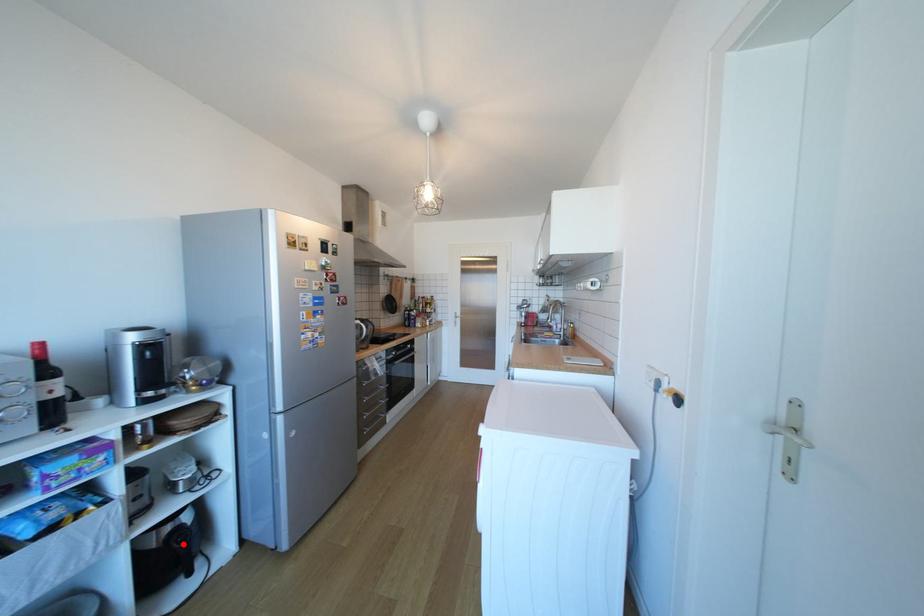
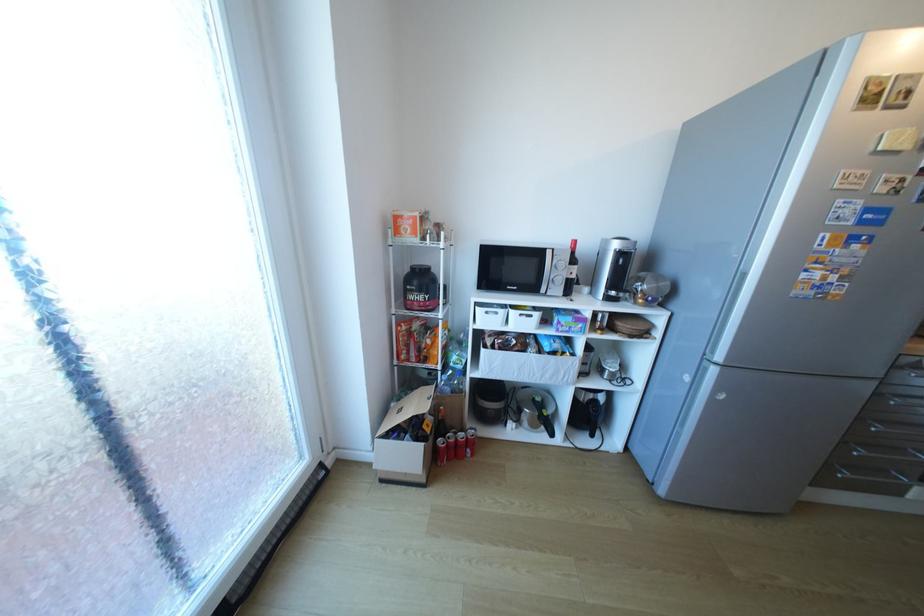
In the second image, find the point that corresponds to the highlighted location in the first image.

(600, 408)